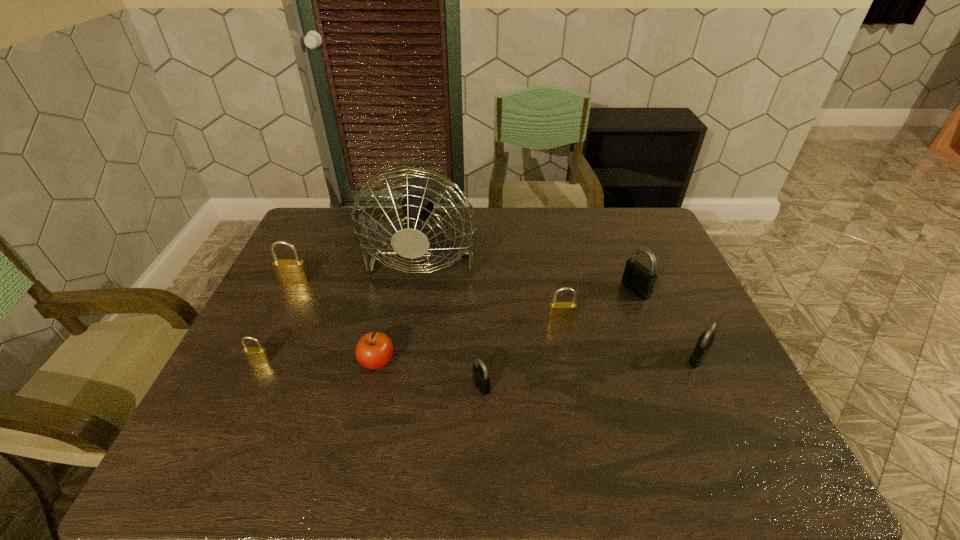
At what (x,y) coordinates should I click in order to perform the action: click on blank region between the second biggest brass padlock and the tallest object. Please return your answer as a coordinate pair (x, y). This screenshot has width=960, height=540. Looking at the image, I should click on (492, 285).

Where is `unoccupied area between the rightmost padlock and the farthest black padlock`? unoccupied area between the rightmost padlock and the farthest black padlock is located at coordinates (666, 323).

Locate an element on the screen. free space between the biggest brass padlock and the second farthest brass padlock is located at coordinates (428, 301).

Locate an element on the screen. vacant area between the leftmost black padlock and the smallest brass padlock is located at coordinates (371, 373).

I want to click on free space between the sixth object from left to right and the second black padlock from right to left, so tap(598, 305).

Identify the location of unoccupied position between the rightmost black padlock and the rightmost brass padlock. This screenshot has width=960, height=540. (629, 339).

Where is `empty space between the fourth farthest object and the rightmost object`? empty space between the fourth farthest object and the rightmost object is located at coordinates (629, 339).

I want to click on object that is the closest to the farthest brass padlock, so click(408, 242).

Locate which object ranks third in proximity to the fifth nearest object. Please provide its 2D coordinates. Your answer should be formatted as a tuple, i.e. [(x, y)], where the tuple contains the x and y coordinates of a point satisfying the conditions above.

[(481, 379)]

I want to click on padlock that stands as the second closest to the biggest brass padlock, so click(481, 379).